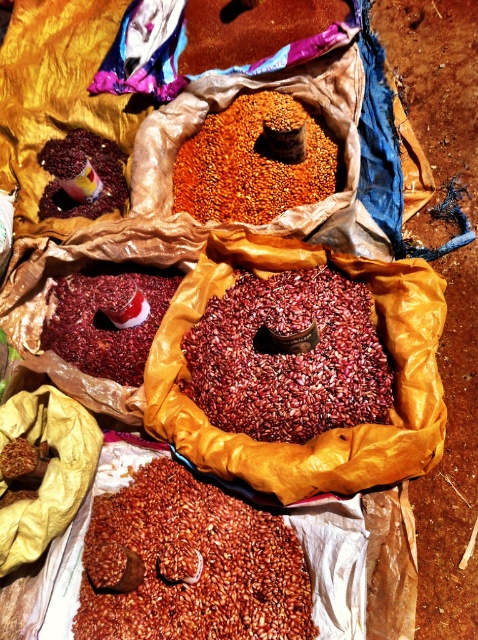
Question: Which object is positioned closest to the dark red grain at center?

Choices:
 (A) shiny plastic cup at upper left
 (B) matte red beans at center
 (C) golden grain at center
 (D) brown matte beans at center

Answer: (B)

Question: Estimate the real-world distances between objects in this image. Which object is closer to the golden grain at center?

Choices:
 (A) matte red beans at center
 (B) dark red grain at center

Answer: (A)

Question: Can you confirm if matte red beans at center is positioned below shiny plastic cup at upper left?

Choices:
 (A) yes
 (B) no

Answer: (A)

Question: Considering the relative positions of dark red grain at center and shiny plastic cup at upper left in the image provided, where is dark red grain at center located with respect to shiny plastic cup at upper left?

Choices:
 (A) right
 (B) left

Answer: (A)

Question: Which point is farther to the camera?

Choices:
 (A) brown matte beans at center
 (B) dark red grain at center

Answer: (B)

Question: Can you confirm if golden grain at center is thinner than shiny plastic cup at upper left?

Choices:
 (A) yes
 (B) no

Answer: (B)